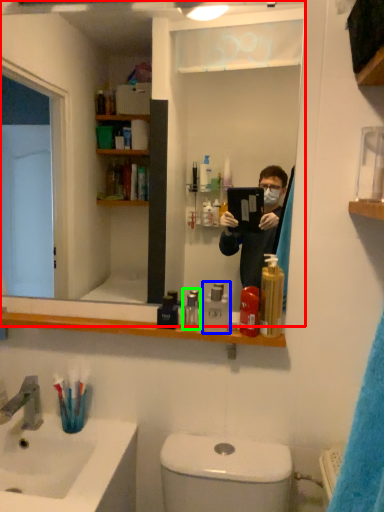
Question: Which object is positioned closest to mirror (highlighted by a red box)? Select from mouthwash (highlighted by a blue box) and mouthwash (highlighted by a green box).

Choices:
 (A) mouthwash
 (B) mouthwash

Answer: (B)